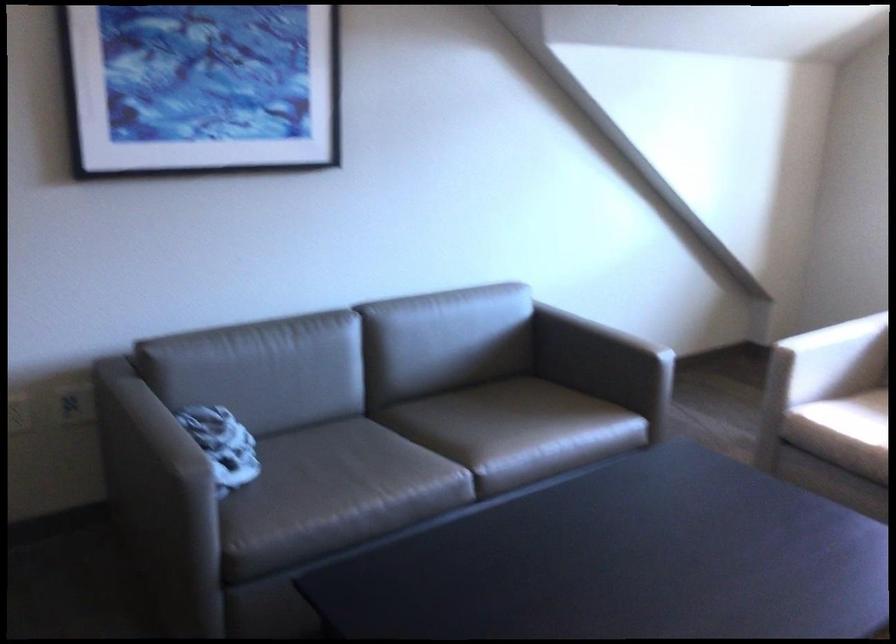
Where would you rest the chair armrest? Please return your answer as a coordinate pair (x, y).

(831, 359)